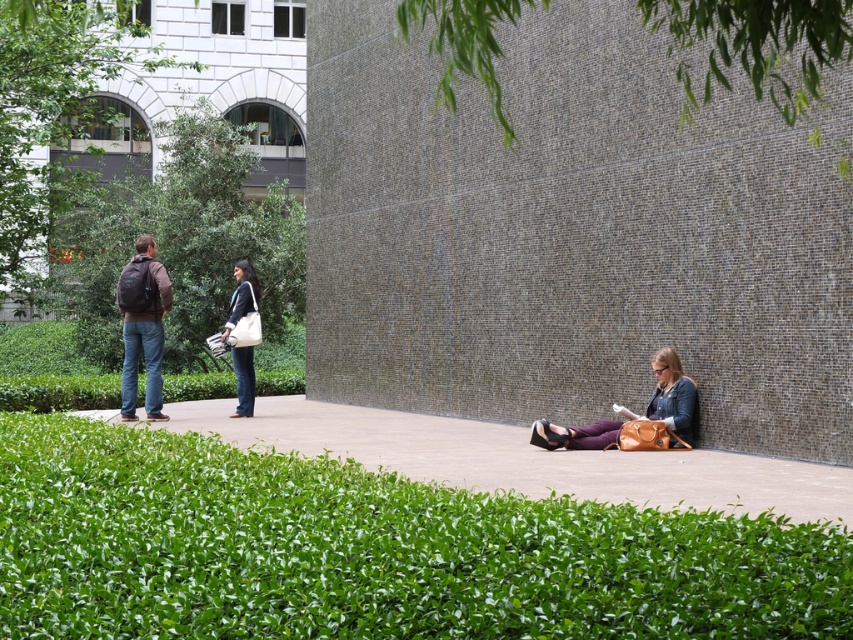
Question: Can you confirm if green leafy grass at lower center is bigger than leather brown purse at lower right?

Choices:
 (A) no
 (B) yes

Answer: (A)

Question: Does green leafy grass at lower center have a smaller size compared to white canvas tote bag at center?

Choices:
 (A) yes
 (B) no

Answer: (A)

Question: Does green leafy hedge at upper left have a lesser width compared to white canvas tote bag at center?

Choices:
 (A) yes
 (B) no

Answer: (B)

Question: Which object appears closest to the camera in this image?

Choices:
 (A) white canvas tote bag at center
 (B) leather brown purse at lower right

Answer: (B)

Question: Which object appears farthest from the camera in this image?

Choices:
 (A) matte black backpack at left
 (B) green leafy grass at lower center
 (C) leather brown purse at lower right

Answer: (A)

Question: Which point is farther to the camera?

Choices:
 (A) leather brown purse at lower right
 (B) white canvas tote bag at center

Answer: (B)